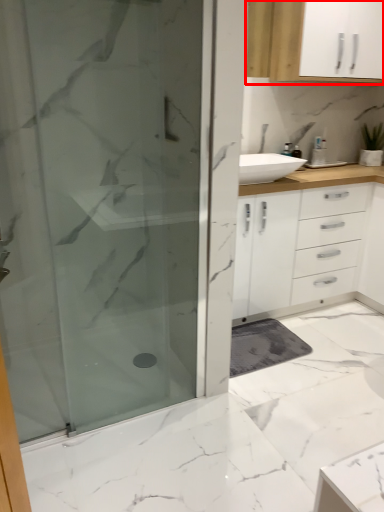
Question: From the image's perspective, what is the correct spatial relationship of cabinetry (annotated by the red box) in relation to shower door?

Choices:
 (A) above
 (B) below

Answer: (A)